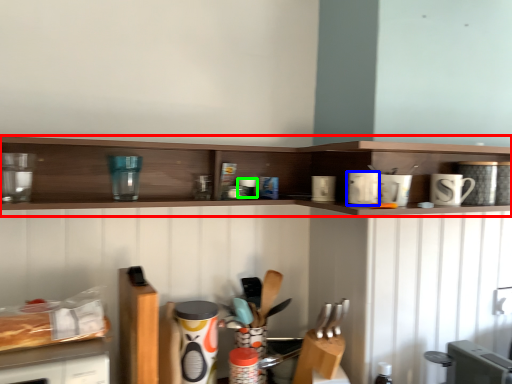
Question: Considering the real-world distances, which object is farthest from shelf (highlighted by a red box)? appliance (highlighted by a blue box) or appliance (highlighted by a green box)?

Choices:
 (A) appliance
 (B) appliance

Answer: (A)